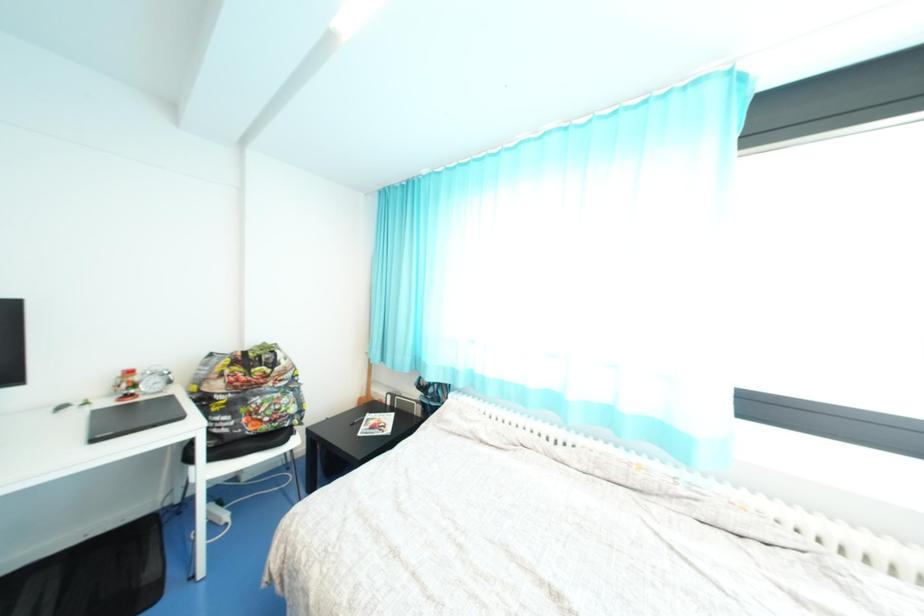
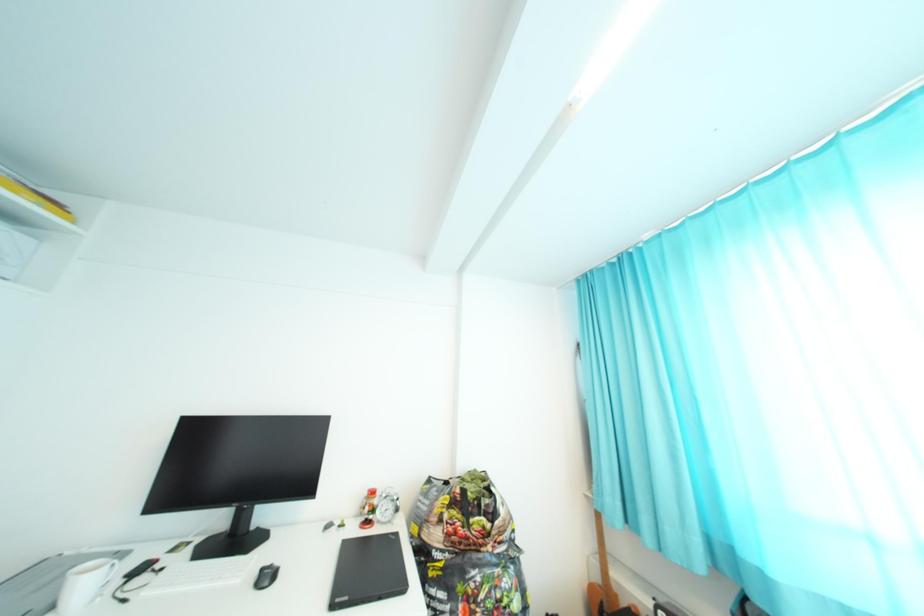
How did the camera likely rotate?

The camera's rotation is toward left-up.